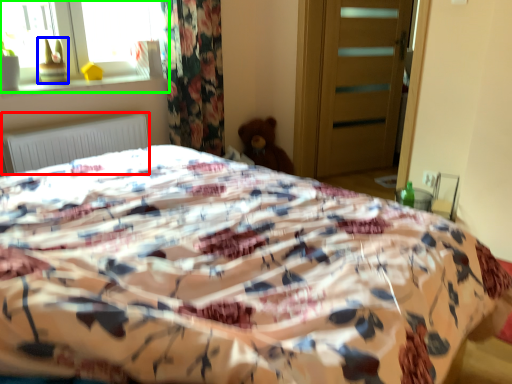
Question: Considering the real-world distances, which object is farthest from radiator (highlighted by a red box)? toy (highlighted by a blue box) or window (highlighted by a green box)?

Choices:
 (A) toy
 (B) window

Answer: (B)